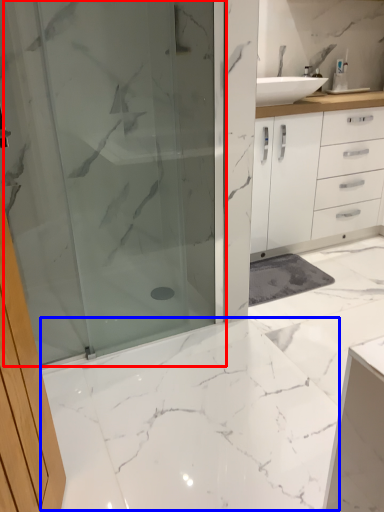
Question: Which object is closer to the camera taking this photo, shower door (highlighted by a red box) or marble (highlighted by a blue box)?

Choices:
 (A) shower door
 (B) marble

Answer: (B)